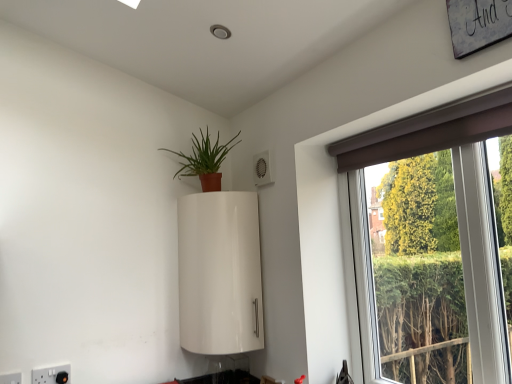
Question: Is white plastic electric outlet at lower left, which appears as the 1th electric outlet when viewed from the back, far from matte terracotta pot at upper center?

Choices:
 (A) yes
 (B) no

Answer: (A)

Question: Can you confirm if white plastic electric outlet at lower left, which is the first electric outlet in right-to-left order, is positioned to the right of matte terracotta pot at upper center?

Choices:
 (A) yes
 (B) no

Answer: (B)

Question: Is the depth of white plastic electric outlet at lower left, which appears as the 1th electric outlet when viewed from the back, less than that of matte terracotta pot at upper center?

Choices:
 (A) yes
 (B) no

Answer: (A)

Question: Is white plastic electric outlet at lower left, positioned as the 2th electric outlet in front-to-back order, facing towards matte terracotta pot at upper center?

Choices:
 (A) yes
 (B) no

Answer: (B)

Question: Considering the relative sizes of white plastic electric outlet at lower left, which appears as the 1th electric outlet when viewed from the back, and matte terracotta pot at upper center in the image provided, is white plastic electric outlet at lower left, which appears as the 1th electric outlet when viewed from the back, shorter than matte terracotta pot at upper center?

Choices:
 (A) yes
 (B) no

Answer: (A)

Question: Looking at their shapes, would you say brown fabric window at upper right is wider or thinner than white plastic electric outlet at lower left, which is the 2th electric outlet in back-to-front order?

Choices:
 (A) thin
 (B) wide

Answer: (B)

Question: From the image's perspective, is brown fabric window at upper right positioned above or below white plastic electric outlet at lower left, which is counted as the second electric outlet, starting from the right?

Choices:
 (A) above
 (B) below

Answer: (A)

Question: In terms of size, does brown fabric window at upper right appear bigger or smaller than white plastic electric outlet at lower left, the first electric outlet viewed from the front?

Choices:
 (A) big
 (B) small

Answer: (A)

Question: From a real-world perspective, is brown fabric window at upper right positioned above or below white plastic electric outlet at lower left, which is the 2th electric outlet in back-to-front order?

Choices:
 (A) above
 (B) below

Answer: (A)

Question: Looking at the image, does white plastic electric outlet at lower left, which appears as the 1th electric outlet when viewed from the back, seem bigger or smaller compared to brown fabric window at upper right?

Choices:
 (A) small
 (B) big

Answer: (A)

Question: Does point (61, 374) appear closer or farther from the camera than point (413, 125)?

Choices:
 (A) farther
 (B) closer

Answer: (A)

Question: Considering the positions of white plastic electric outlet at lower left, which is the first electric outlet in right-to-left order, and brown fabric window at upper right in the image, is white plastic electric outlet at lower left, which is the first electric outlet in right-to-left order, wider or thinner than brown fabric window at upper right?

Choices:
 (A) thin
 (B) wide

Answer: (A)

Question: From a real-world perspective, is white plastic electric outlet at lower left, which appears as the 1th electric outlet when viewed from the back, physically located above or below brown fabric window at upper right?

Choices:
 (A) above
 (B) below

Answer: (B)

Question: From the image's perspective, is white glossy cabinet at upper center above or below brown fabric window at upper right?

Choices:
 (A) below
 (B) above

Answer: (A)

Question: In terms of size, does white glossy cabinet at upper center appear bigger or smaller than brown fabric window at upper right?

Choices:
 (A) small
 (B) big

Answer: (B)